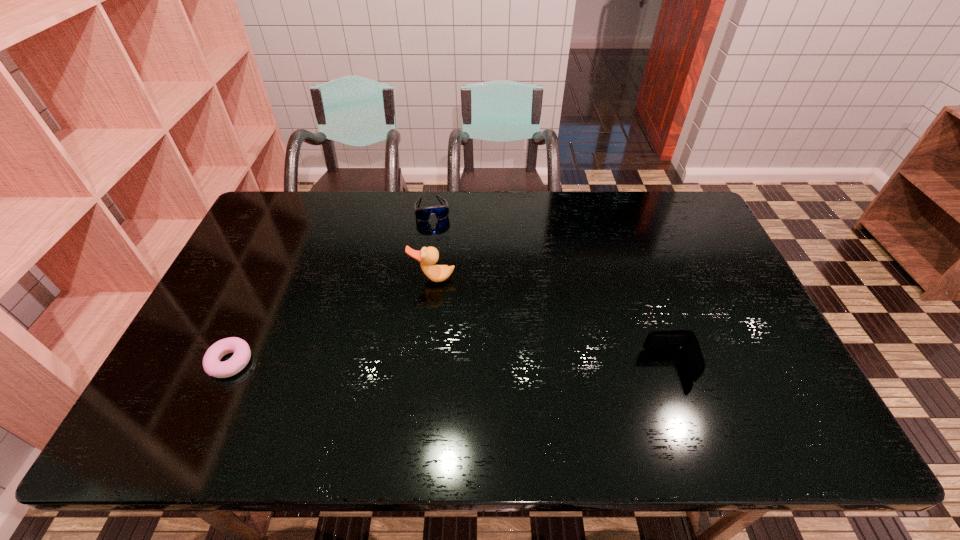
You are a GUI agent. You are given a task and a screenshot of the screen. Output one action in this format:
    pyautogui.click(x=<x>, y=<y>)
    Task: Click on the free space located on the outer surface of the second tallest object
    The image size is (960, 540).
    Given the screenshot: What is the action you would take?
    pyautogui.click(x=518, y=366)

Identify the location of vacant position located 0.180m on the outer surface of the second tallest object. (574, 366).

Find the location of a particular element. The width and height of the screenshot is (960, 540). vacant space located 0.200m on the beak of the duck is located at coordinates (425, 341).

Find the location of a particular element. vacant space located 0.320m on the beak of the duck is located at coordinates (420, 382).

Locate an element on the screen. The height and width of the screenshot is (540, 960). vacant space situated 0.060m on the beak of the duck is located at coordinates (430, 301).

Find the location of `vacant area situated 0.140m on the front-facing side of the sunglasses`. vacant area situated 0.140m on the front-facing side of the sunglasses is located at coordinates (439, 251).

Locate an element on the screen. The height and width of the screenshot is (540, 960). vacant area situated on the front-facing side of the sunglasses is located at coordinates click(x=442, y=266).

Locate an element on the screen. This screenshot has height=540, width=960. free location located on the front-facing side of the sunglasses is located at coordinates (436, 234).

Identify the location of object situated at the far edge. pos(441,212).

The height and width of the screenshot is (540, 960). Find the location of `pastry that is at the near edge`. pastry that is at the near edge is located at coordinates (212, 366).